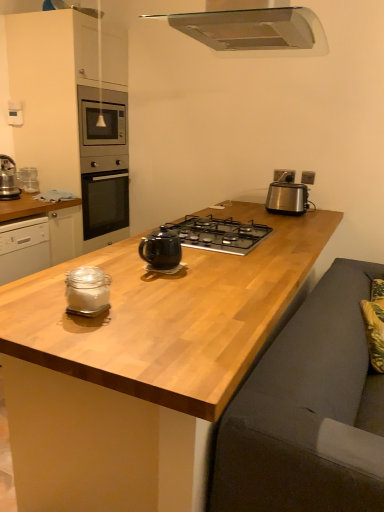
Question: From the image's perspective, is satin silver toaster at right located above or below wooden at center?

Choices:
 (A) below
 (B) above

Answer: (B)

Question: Based on their positions, is satin silver toaster at right located to the left or right of wooden at center?

Choices:
 (A) right
 (B) left

Answer: (A)

Question: Estimate the real-world distances between objects in this image. Which object is closer to the satin silver toaster at right?

Choices:
 (A) metallic stainless steel range hood at upper center
 (B) black glass gas stove at center
 (C) silver metallic outlet at upper right, the 2th electric outlet in the left-to-right sequence
 (D) wooden at center
 (E) black glossy teapot at center

Answer: (C)

Question: Which object is positioned farthest from the matte gray cabinetry at upper left, the 1th cabinetry positioned from the top?

Choices:
 (A) black glass gas stove at center
 (B) silver metallic outlet at upper right, acting as the first electric outlet starting from the right
 (C) clear glass jar at center
 (D) satin silver toaster at right
 (E) clear glass jar at left, which appears as the 1th cabinetry when ordered from the bottom

Answer: (C)